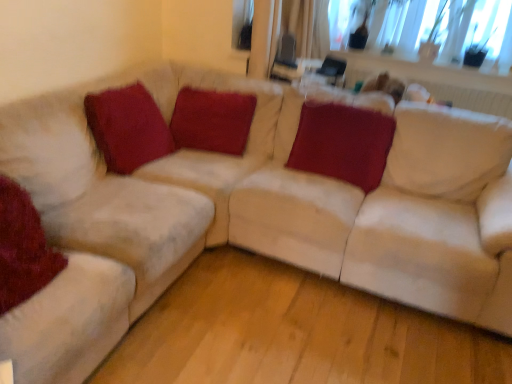
Question: From a real-world perspective, is satin red pillow at center, which is counted as the 1th pillow, starting from the right, located beneath velvet red pillow at center, which is counted as the 3th pillow, starting from the left?

Choices:
 (A) yes
 (B) no

Answer: (B)

Question: Can velvet red pillow at center, which is counted as the 3th pillow, starting from the left, be found inside satin red pillow at center, which is counted as the 1th pillow, starting from the right?

Choices:
 (A) no
 (B) yes

Answer: (A)

Question: Can you confirm if satin red pillow at center, which appears as the 4th pillow when viewed from the left, is wider than velvet red pillow at center, which is counted as the 3th pillow, starting from the left?

Choices:
 (A) no
 (B) yes

Answer: (B)

Question: Is satin red pillow at center, which appears as the 4th pillow when viewed from the left, next to velvet red pillow at center, which is counted as the 3th pillow, starting from the left?

Choices:
 (A) yes
 (B) no

Answer: (B)

Question: Is satin red pillow at center, which appears as the 4th pillow when viewed from the left, smaller than velvet red pillow at center, which is counted as the 3th pillow, starting from the left?

Choices:
 (A) no
 (B) yes

Answer: (A)

Question: Does satin red pillow at center, which appears as the 4th pillow when viewed from the left, come in front of velvet red pillow at center, which is the second pillow from right to left?

Choices:
 (A) no
 (B) yes

Answer: (B)

Question: Does velvet red pillow at center, which is counted as the 3th pillow, starting from the left, touch velvet red pillow at lower left, acting as the 4th pillow starting from the right?

Choices:
 (A) yes
 (B) no

Answer: (B)

Question: From a real-world perspective, does velvet red pillow at center, which is the second pillow from right to left, sit lower than velvet red pillow at lower left, which is counted as the first pillow, starting from the left?

Choices:
 (A) yes
 (B) no

Answer: (A)

Question: Can you confirm if velvet red pillow at center, which is the second pillow from right to left, is thinner than velvet red pillow at lower left, which is counted as the first pillow, starting from the left?

Choices:
 (A) no
 (B) yes

Answer: (B)

Question: From a real-world perspective, is velvet red pillow at center, which is counted as the 3th pillow, starting from the left, on top of velvet red pillow at lower left, acting as the 4th pillow starting from the right?

Choices:
 (A) yes
 (B) no

Answer: (B)

Question: Could velvet red pillow at lower left, acting as the 4th pillow starting from the right, be considered to be inside velvet red pillow at center, which is the second pillow from right to left?

Choices:
 (A) no
 (B) yes

Answer: (A)

Question: Is velvet red pillow at center, which is counted as the 3th pillow, starting from the left, further to camera compared to velvet red pillow at lower left, acting as the 4th pillow starting from the right?

Choices:
 (A) yes
 (B) no

Answer: (A)

Question: Is velvet red pillow at lower left, which is counted as the first pillow, starting from the left, to the right of satin red pillow at center, which appears as the 4th pillow when viewed from the left, from the viewer's perspective?

Choices:
 (A) yes
 (B) no

Answer: (B)